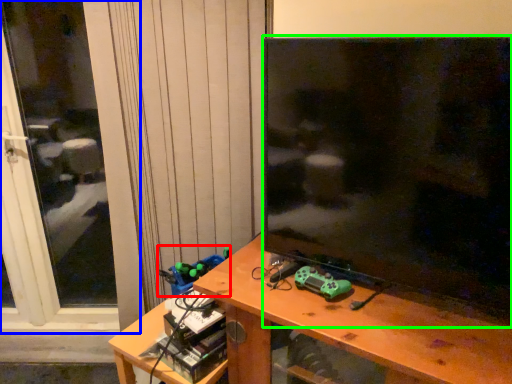
Question: Which is farther away from toy (highlighted by a red box)? screen door (highlighted by a blue box) or television (highlighted by a green box)?

Choices:
 (A) screen door
 (B) television

Answer: (A)